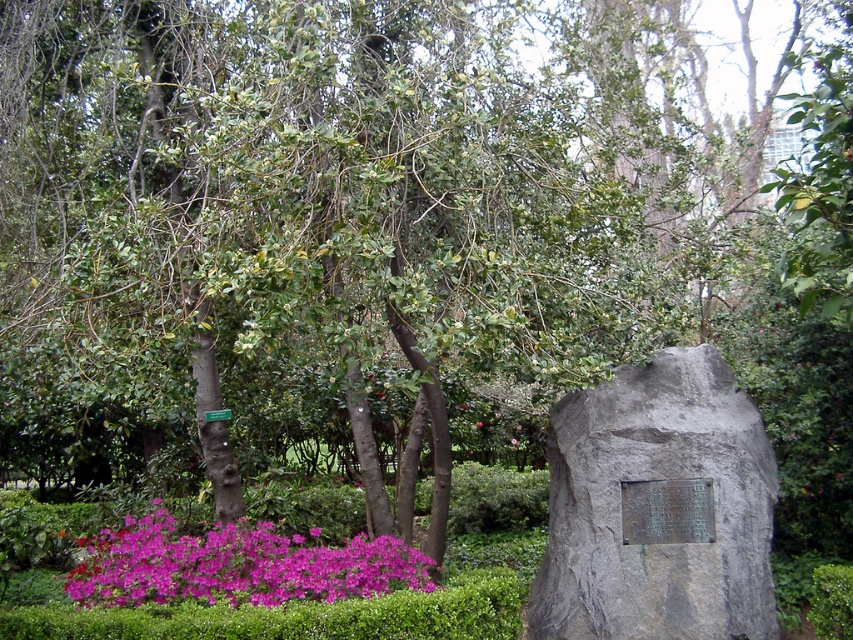
You are a gardener planning to place a new decorative item in the garden. You have a small statue that is 1 meter wide. You want to place it near the gray stone plaque at right and the purple matte flowers at lower left. Based on their sizes, which object can the statue be placed next to without overlapping?

The gray stone plaque at right has a lesser width compared to purple matte flowers at lower left. Since the statue is 1 meter wide, it can be placed next to the gray stone plaque at right as it is narrower, allowing more space for the statue without overlapping.

Looking at this image, you are a gardener who wants to place a new decorative item between the gray stone plaque at right and the purple matte flowers at lower left. The decorative item is 3 feet wide. Can you fit it between them without moving either object?

The distance between the gray stone plaque at right and the purple matte flowers at lower left is 5.28 feet. Since the decorative item is 3 feet wide, it can fit as the available space is larger than the item.